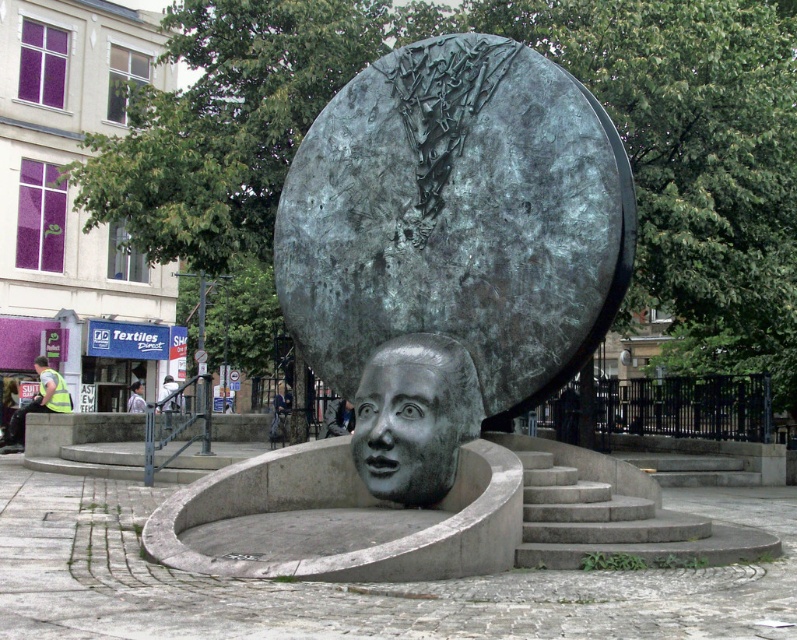
You are standing at the base of the sculpture and want to place a 30 feet long banner between the bronze textured sphere at center and another object. Is there enough space?

The bronze textured sphere at center and the other object are 30.95 feet apart, so there is enough space to place a 30 feet long banner between them.

You are an artist planning to create a miniature version of this sculpture. You need to know which object is thinner between the bronze textured sphere at center and the reflective silver helmet at lower left to ensure proper scaling. Which one should you scale down more carefully?

The bronze textured sphere at center is thinner than the reflective silver helmet at lower left, so you should scale down the bronze textured sphere at center more carefully to maintain its proportions.

You are a maintenance worker inspecting the sculpture. You need to clean both the bronze face at center and the bronze sculpture at center. Which one should you clean first if you want to start from the lowest part?

The bronze face at center should be cleaned first because it is positioned below the bronze sculpture at center, making it the lower part of the structure.